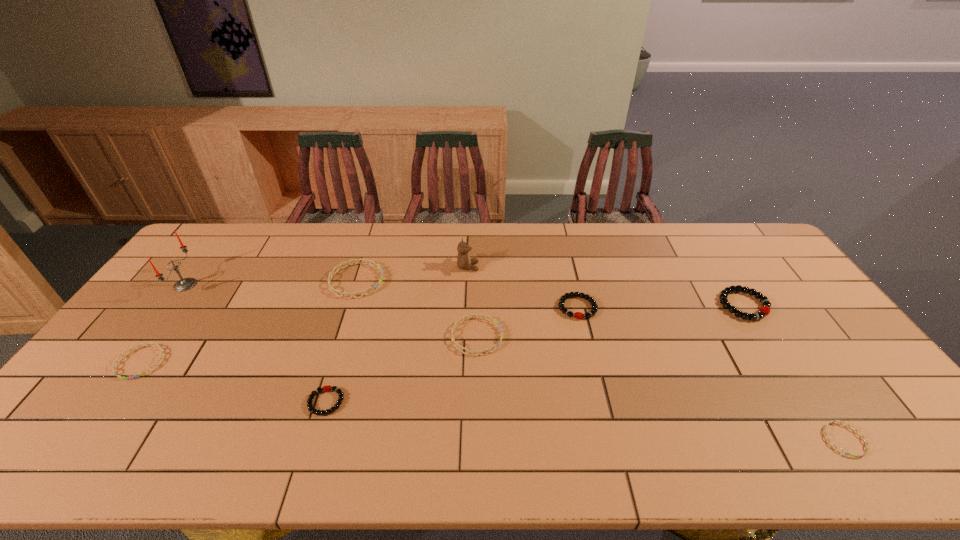
Point out which blue bracelet is positioned as the second nearest to the fourth bracelet from left to right. Please provide its 2D coordinates. Your answer should be formatted as a tuple, i.e. [(x, y)], where the tuple contains the x and y coordinates of a point satisfying the conditions above.

[(825, 433)]

Locate which black bracelet ranks second in proximity to the second smallest black bracelet. Please provide its 2D coordinates. Your answer should be formatted as a tuple, i.e. [(x, y)], where the tuple contains the x and y coordinates of a point satisfying the conditions above.

[(324, 388)]

Select which black bracelet appears as the second closest to the leftmost bracelet. Please provide its 2D coordinates. Your answer should be formatted as a tuple, i.e. [(x, y)], where the tuple contains the x and y coordinates of a point satisfying the conditions above.

[(578, 315)]

Find the location of a particular element. The width and height of the screenshot is (960, 540). vacant region that satisfies the following two spatial constraints: 1. on the front-facing side of the second tallest object; 2. on the back side of the biggest black bracelet is located at coordinates (467, 305).

Locate an element on the screen. free space that satisfies the following two spatial constraints: 1. on the front side of the second biggest black bracelet; 2. on the surface of the fourth bracelet from left to right showing star-shaped elements is located at coordinates (584, 336).